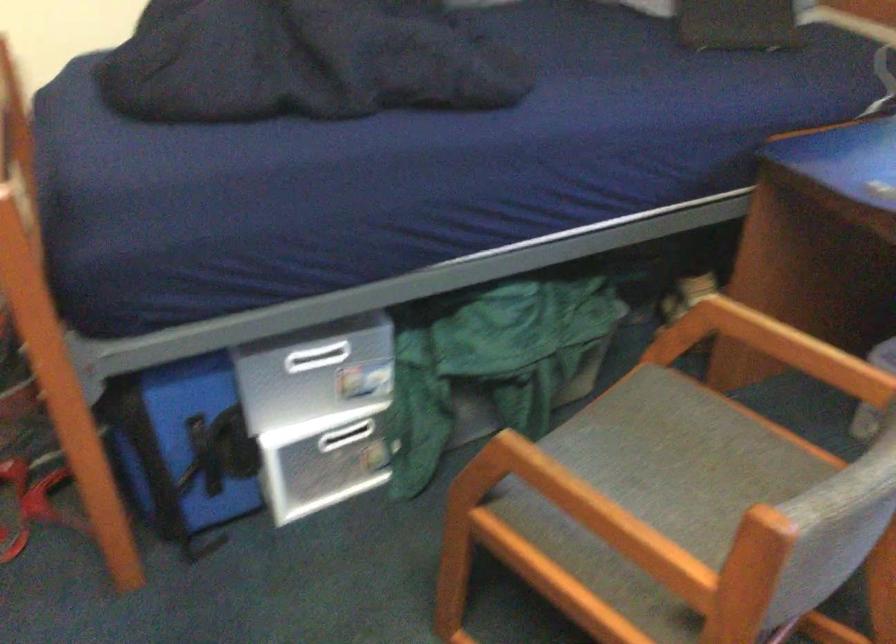
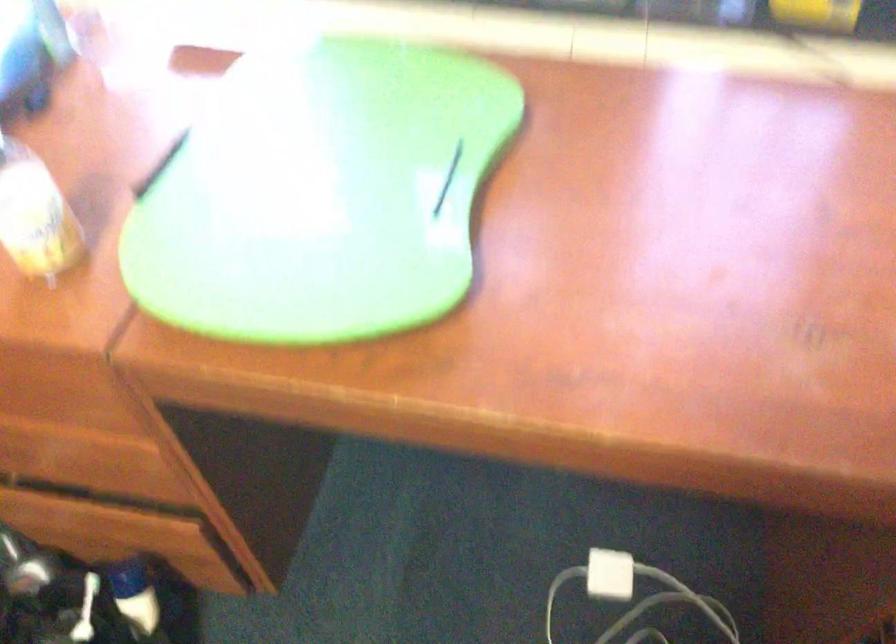
The images are taken continuously from a first-person perspective. In which direction is your viewpoint rotating?

The rotation direction of the camera is right-down.